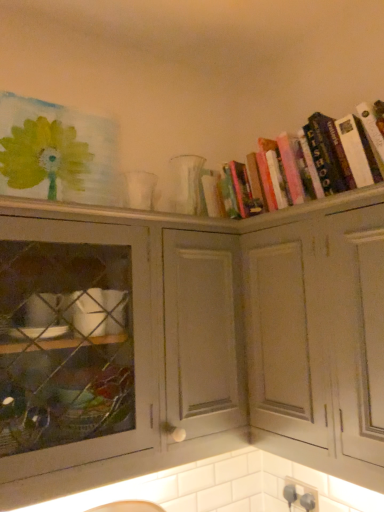
Question: Can you confirm if hardcover books at upper right is positioned to the right of matte gray cabinet at center, which ranks as the second cabinetry in right-to-left order?

Choices:
 (A) no
 (B) yes

Answer: (B)

Question: Is hardcover books at upper right positioned behind matte gray cabinet at center, which ranks as the first cabinetry in left-to-right order?

Choices:
 (A) no
 (B) yes

Answer: (B)

Question: Is hardcover books at upper right at the left side of matte gray cabinet at center, which ranks as the second cabinetry in right-to-left order?

Choices:
 (A) yes
 (B) no

Answer: (B)

Question: From the image's perspective, is hardcover books at upper right on top of matte gray cabinet at center, which ranks as the second cabinetry in right-to-left order?

Choices:
 (A) no
 (B) yes

Answer: (B)

Question: Is hardcover books at upper right thinner than matte gray cabinet at center, which ranks as the second cabinetry in right-to-left order?

Choices:
 (A) no
 (B) yes

Answer: (B)

Question: In terms of height, does hardcover books at upper right look taller or shorter compared to white matte cabinet at upper right, the first cabinetry from the right?

Choices:
 (A) short
 (B) tall

Answer: (A)

Question: Is hardcover books at upper right spatially inside white matte cabinet at upper right, which is counted as the 2th cabinetry, starting from the left, or outside of it?

Choices:
 (A) outside
 (B) inside

Answer: (A)

Question: Is point (x=319, y=184) closer or farther from the camera than point (x=362, y=474)?

Choices:
 (A) closer
 (B) farther

Answer: (B)

Question: Is hardcover books at upper right to the left or to the right of white matte cabinet at upper right, which is counted as the 2th cabinetry, starting from the left, in the image?

Choices:
 (A) left
 (B) right

Answer: (B)

Question: Is point (253, 180) closer or farther from the camera than point (137, 345)?

Choices:
 (A) farther
 (B) closer

Answer: (A)

Question: Do you think hardcover books at upper right is within matte gray cabinet at center, which ranks as the first cabinetry in left-to-right order, or outside of it?

Choices:
 (A) outside
 (B) inside

Answer: (A)

Question: Based on their sizes in the image, would you say hardcover books at upper right is bigger or smaller than matte gray cabinet at center, which ranks as the first cabinetry in left-to-right order?

Choices:
 (A) big
 (B) small

Answer: (B)

Question: From a real-world perspective, is hardcover books at upper right physically located above or below matte gray cabinet at center, which ranks as the first cabinetry in left-to-right order?

Choices:
 (A) above
 (B) below

Answer: (A)

Question: Would you say white matte cabinet at upper right, the first cabinetry from the right, is inside or outside hardcover books at upper right?

Choices:
 (A) inside
 (B) outside

Answer: (B)

Question: In terms of height, does white matte cabinet at upper right, the first cabinetry from the right, look taller or shorter compared to hardcover books at upper right?

Choices:
 (A) short
 (B) tall

Answer: (B)